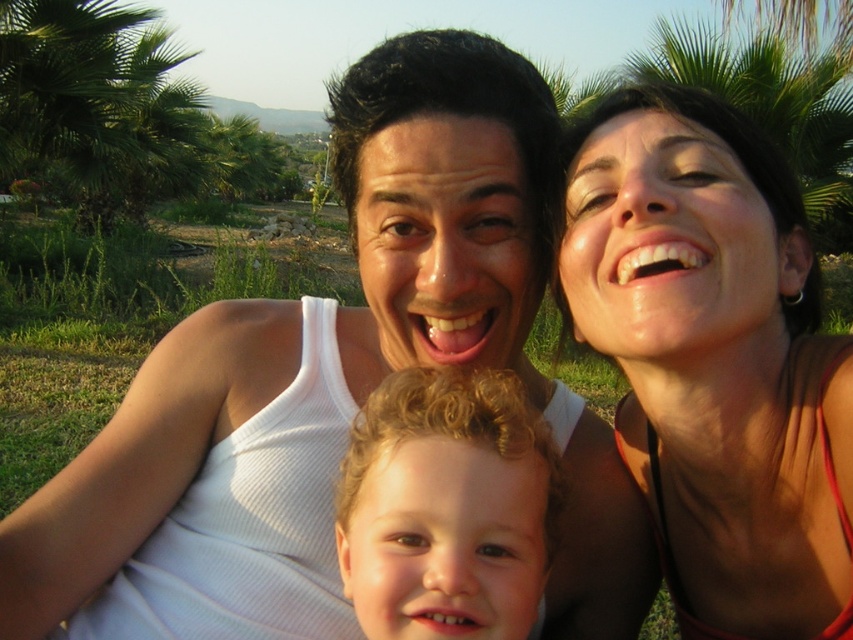
You are a photographer trying to capture the perfect shot of the two adults in the scene. Since the white ribbed tank top at center and the matte red tank top at upper right are at different heights, which adult should you focus on to ensure their full torso is visible in the frame?

The white ribbed tank top at center has a greater height compared to the matte red tank top at upper right, so focusing on the adult wearing the white ribbed tank top at center will ensure their full torso is visible in the frame.

You are a photographer trying to capture a closeup of the curly blonde hair at center and the white ribbed tank top at center in the scene. Based on their sizes, which one should you focus on first to ensure both are in frame?

The white ribbed tank top at center is larger in size than the curly blonde hair at center, so you should focus on the white ribbed tank top at center first to ensure both fit within the frame.

You are a photographer standing 1 meter away from the family. You want to take a closeup shot of the white ribbed tank top at center and curly blonde hair at center. Can you capture both subjects in the same frame without moving the camera?

The distance between the white ribbed tank top at center and curly blonde hair at center is 20.60 centimeters. Since they are only 20.60 centimeters apart, you can easily capture both subjects in the same frame without moving the camera.